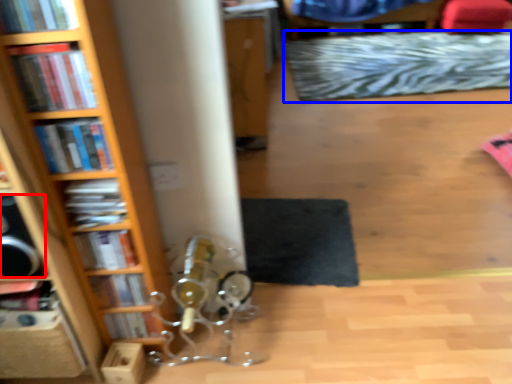
Question: Among these objects, which one is farthest to the camera, speaker (highlighted by a red box) or mat (highlighted by a blue box)?

Choices:
 (A) speaker
 (B) mat

Answer: (B)